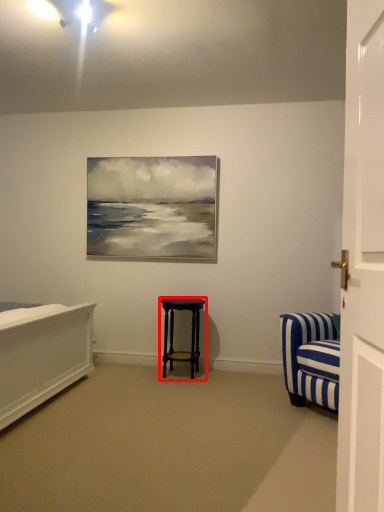
Question: Considering the relative positions of stool (annotated by the red box) and door in the image provided, where is stool (annotated by the red box) located with respect to the staircase?

Choices:
 (A) right
 (B) left

Answer: (B)